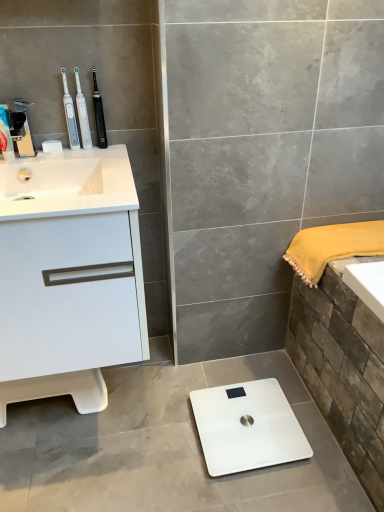
Image resolution: width=384 pixels, height=512 pixels. What do you see at coordinates (82, 114) in the screenshot?
I see `white plastic toothbrush at upper left, which ranks as the second toothbrush in left-to-right order` at bounding box center [82, 114].

How much space does white glossy toothbrush at upper left, arranged as the third toothbrush when viewed from the right, occupy horizontally?

It is 1.13 inches.

The width and height of the screenshot is (384, 512). Describe the element at coordinates (70, 115) in the screenshot. I see `white glossy toothbrush at upper left, the first toothbrush when ordered from left to right` at that location.

Where is `yellow fluffy towel at right`? The width and height of the screenshot is (384, 512). yellow fluffy towel at right is located at coordinates (332, 247).

What do you see at coordinates (247, 426) in the screenshot?
I see `white glossy scale at center` at bounding box center [247, 426].

Describe the element at coordinates (69, 282) in the screenshot. I see `white glossy cabinet at left` at that location.

Describe the element at coordinates (99, 114) in the screenshot. I see `black plastic toothbrush at upper center, acting as the 3th toothbrush starting from the left` at that location.

Locate an element on the screen. This screenshot has width=384, height=512. brushed metal faucet at upper left, which is the 2th toiletry from left to right is located at coordinates (20, 126).

Who is smaller, white glossy scale at center or white plastic toothbrush at upper left, which ranks as the second toothbrush in left-to-right order?

white plastic toothbrush at upper left, which ranks as the second toothbrush in left-to-right order, is smaller.

How many degrees apart are the facing directions of white glossy scale at center and white plastic toothbrush at upper left, the 2th toothbrush when ordered from right to left?

The angle between the facing direction of white glossy scale at center and the facing direction of white plastic toothbrush at upper left, the 2th toothbrush when ordered from right to left, is 88 degrees.

Would you say white glossy scale at center is outside white plastic toothbrush at upper left, the 2th toothbrush when ordered from right to left?

white glossy scale at center lies outside white plastic toothbrush at upper left, the 2th toothbrush when ordered from right to left,'s area.

Considering the relative positions of white glossy scale at center and white plastic toothbrush at upper left, which ranks as the second toothbrush in left-to-right order, in the image provided, is white glossy scale at center to the right of white plastic toothbrush at upper left, which ranks as the second toothbrush in left-to-right order, from the viewer's perspective?

Correct, you'll find white glossy scale at center to the right of white plastic toothbrush at upper left, which ranks as the second toothbrush in left-to-right order.

Which is farther, (20, 148) or (335, 248)?

The point (335, 248) is behind.

Can we say brushed metal faucet at upper left, the 1th toiletry positioned from the right, lies outside yellow fluffy towel at right?

brushed metal faucet at upper left, the 1th toiletry positioned from the right, is positioned outside yellow fluffy towel at right.

Could you tell me if brushed metal faucet at upper left, the 1th toiletry positioned from the right, is facing yellow fluffy towel at right?

No, brushed metal faucet at upper left, the 1th toiletry positioned from the right, is not turned towards yellow fluffy towel at right.

Is matte plastic toothpaste tube at left, the 2th toiletry viewed from the right, in front of white glossy sink at upper left?

That is False.

From a real-world perspective, is matte plastic toothpaste tube at left, the 2th toiletry viewed from the right, positioned above or below white glossy sink at upper left?

matte plastic toothpaste tube at left, the 2th toiletry viewed from the right, is above white glossy sink at upper left.

Is matte plastic toothpaste tube at left, the first toiletry when ordered from left to right, taller or shorter than white glossy sink at upper left?

matte plastic toothpaste tube at left, the first toiletry when ordered from left to right, is taller than white glossy sink at upper left.

Which is farther, (6, 149) or (14, 185)?

The point (14, 185) is more distant.

Based on their sizes in the image, would you say white glossy sink at upper left is bigger or smaller than matte plastic toothpaste tube at left, the 2th toiletry viewed from the right?

white glossy sink at upper left is bigger than matte plastic toothpaste tube at left, the 2th toiletry viewed from the right.

Considering the sizes of objects white glossy sink at upper left and matte plastic toothpaste tube at left, the 2th toiletry viewed from the right, in the image provided, who is taller, white glossy sink at upper left or matte plastic toothpaste tube at left, the 2th toiletry viewed from the right,?

matte plastic toothpaste tube at left, the 2th toiletry viewed from the right, is taller.

Is white glossy sink at upper left thinner than matte plastic toothpaste tube at left, the first toiletry when ordered from left to right?

In fact, white glossy sink at upper left might be wider than matte plastic toothpaste tube at left, the first toiletry when ordered from left to right.

Is matte plastic toothpaste tube at left, the first toiletry when ordered from left to right, a part of white glossy sink at upper left?

No, white glossy sink at upper left does not contain matte plastic toothpaste tube at left, the first toiletry when ordered from left to right.

Could you tell me if white glossy cabinet at left is facing white plastic toothbrush at upper left, which ranks as the second toothbrush in left-to-right order?

No, white glossy cabinet at left is not aimed at white plastic toothbrush at upper left, which ranks as the second toothbrush in left-to-right order.

Considering the sizes of objects white glossy cabinet at left and white plastic toothbrush at upper left, which ranks as the second toothbrush in left-to-right order, in the image provided, who is thinner, white glossy cabinet at left or white plastic toothbrush at upper left, which ranks as the second toothbrush in left-to-right order,?

white plastic toothbrush at upper left, which ranks as the second toothbrush in left-to-right order, is thinner.

Is white glossy cabinet at left positioned behind white plastic toothbrush at upper left, the 2th toothbrush when ordered from right to left?

No, white glossy cabinet at left is closer to the viewer.

Which is closer to the camera, (36, 200) or (246, 435)?

Point (36, 200) is closer to the camera than point (246, 435).

Is white glossy sink at upper left not close to white glossy scale at center?

white glossy sink at upper left is actually quite close to white glossy scale at center.

Between white glossy sink at upper left and white glossy scale at center, which one appears on the right side from the viewer's perspective?

white glossy scale at center is more to the right.

Considering the relative sizes of white glossy sink at upper left and white glossy scale at center in the image provided, is white glossy sink at upper left thinner than white glossy scale at center?

Incorrect, the width of white glossy sink at upper left is not less than that of white glossy scale at center.

Can you confirm if white glossy sink at upper left is wider than brushed metal faucet at upper left, the 1th toiletry positioned from the right?

Result: Yes, white glossy sink at upper left is wider than brushed metal faucet at upper left, the 1th toiletry positioned from the right.

Considering the relative sizes of white glossy sink at upper left and brushed metal faucet at upper left, which is the 2th toiletry from left to right, in the image provided, is white glossy sink at upper left bigger than brushed metal faucet at upper left, which is the 2th toiletry from left to right,?

Correct, white glossy sink at upper left is larger in size than brushed metal faucet at upper left, which is the 2th toiletry from left to right.

From the image's perspective, would you say white glossy sink at upper left is shown under brushed metal faucet at upper left, which is the 2th toiletry from left to right?

Correct, white glossy sink at upper left appears lower than brushed metal faucet at upper left, which is the 2th toiletry from left to right, in the image.

What are the coordinates of `toothbrush that is the 1st one when counting forward from the white glossy scale at center` in the screenshot? It's located at (82, 114).

Image resolution: width=384 pixels, height=512 pixels. I want to click on the 2nd toiletry positioned above the yellow fluffy towel at right (from the image's perspective), so click(x=20, y=126).

Based on their spatial positions, is white glossy sink at upper left or white plastic toothbrush at upper left, which ranks as the second toothbrush in left-to-right order, closer to white glossy cabinet at left?

Among the two, white glossy sink at upper left is located nearer to white glossy cabinet at left.

Based on their spatial positions, is white glossy cabinet at left or black plastic toothbrush at upper center, acting as the 3th toothbrush starting from the left, further from white glossy toothbrush at upper left, arranged as the third toothbrush when viewed from the right?

white glossy cabinet at left is positioned further to the anchor white glossy toothbrush at upper left, arranged as the third toothbrush when viewed from the right.

Based on their spatial positions, is white glossy sink at upper left or matte plastic toothpaste tube at left, the 2th toiletry viewed from the right, further from black plastic toothbrush at upper center, acting as the 3th toothbrush starting from the left?

white glossy sink at upper left lies further to black plastic toothbrush at upper center, acting as the 3th toothbrush starting from the left, than the other object.

Considering their positions, is white glossy scale at center positioned further to brushed metal faucet at upper left, the 1th toiletry positioned from the right, than white glossy cabinet at left?

white glossy scale at center.

Which object lies nearer to the anchor point yellow fluffy towel at right, white glossy scale at center or matte plastic toothpaste tube at left, the first toiletry when ordered from left to right?

white glossy scale at center lies closer to yellow fluffy towel at right than the other object.

Estimate the real-world distances between objects in this image. Which object is closer to brushed metal faucet at upper left, which is the 2th toiletry from left to right, yellow fluffy towel at right or black plastic toothbrush at upper center, which is the 1th toothbrush in right-to-left order?

The object closer to brushed metal faucet at upper left, which is the 2th toiletry from left to right, is black plastic toothbrush at upper center, which is the 1th toothbrush in right-to-left order.

Looking at the image, which one is located closer to black plastic toothbrush at upper center, which is the 1th toothbrush in right-to-left order, brushed metal faucet at upper left, the 1th toiletry positioned from the right, or white glossy toothbrush at upper left, the first toothbrush when ordered from left to right?

white glossy toothbrush at upper left, the first toothbrush when ordered from left to right, is closer to black plastic toothbrush at upper center, which is the 1th toothbrush in right-to-left order.

From the image, which object appears to be farther from white glossy sink at upper left, yellow fluffy towel at right or white glossy scale at center?

Based on the image, white glossy scale at center appears to be further to white glossy sink at upper left.

At what (x,y) coordinates should I click in order to perform the action: click on scale between white glossy sink at upper left and yellow fluffy towel at right from left to right. Please return your answer as a coordinate pair (x, y). Looking at the image, I should click on pos(247,426).

The height and width of the screenshot is (512, 384). I want to click on toothbrush positioned between white glossy sink at upper left and white plastic toothbrush at upper left, which ranks as the second toothbrush in left-to-right order, from near to far, so click(x=70, y=115).

The image size is (384, 512). I want to click on toiletry that lies between brushed metal faucet at upper left, which is the 2th toiletry from left to right, and white glossy cabinet at left from top to bottom, so click(5, 137).

You are a GUI agent. You are given a task and a screenshot of the screen. Output one action in this format:
    pyautogui.click(x=<x>, y=<y>)
    Task: Click on the scale situated between white glossy cabinet at left and yellow fluffy towel at right from left to right
    The width and height of the screenshot is (384, 512).
    Given the screenshot: What is the action you would take?
    pyautogui.click(x=247, y=426)